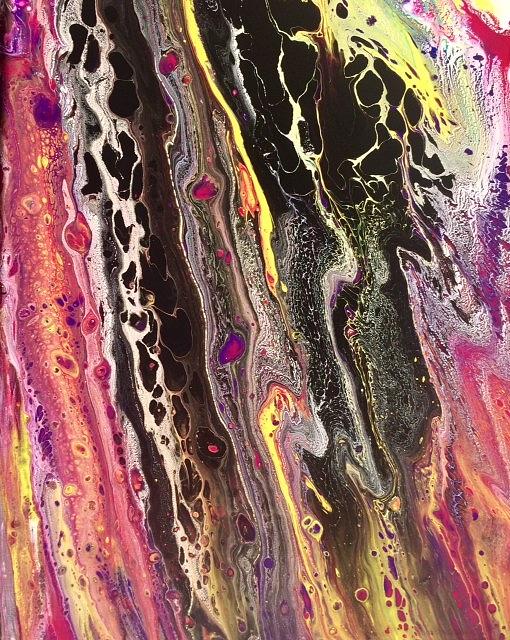
The width and height of the screenshot is (510, 640). What are the coordinates of `yellow paint` in the screenshot? It's located at (382, 35), (222, 102), (282, 482), (387, 609), (483, 4).